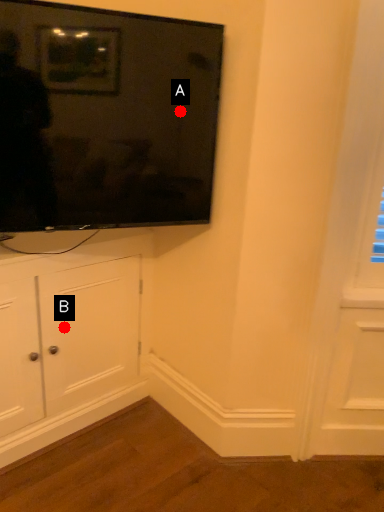
Question: Two points are circled on the image, labeled by A and B beside each circle. Which point is closer to the camera?

Choices:
 (A) A is closer
 (B) B is closer

Answer: (A)